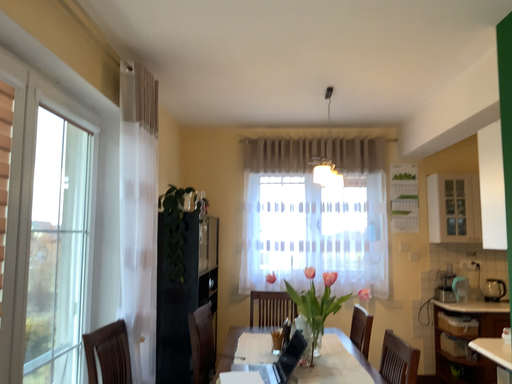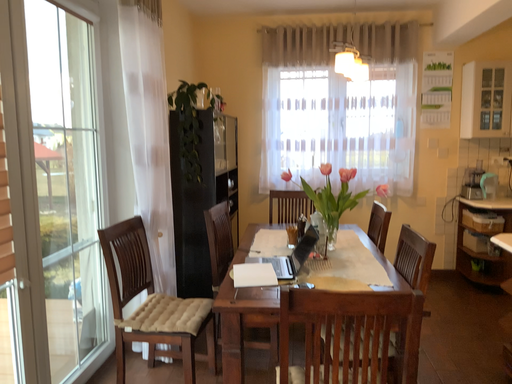
Question: How did the camera likely rotate when shooting the video?

Choices:
 (A) rotated downward
 (B) rotated upward

Answer: (A)